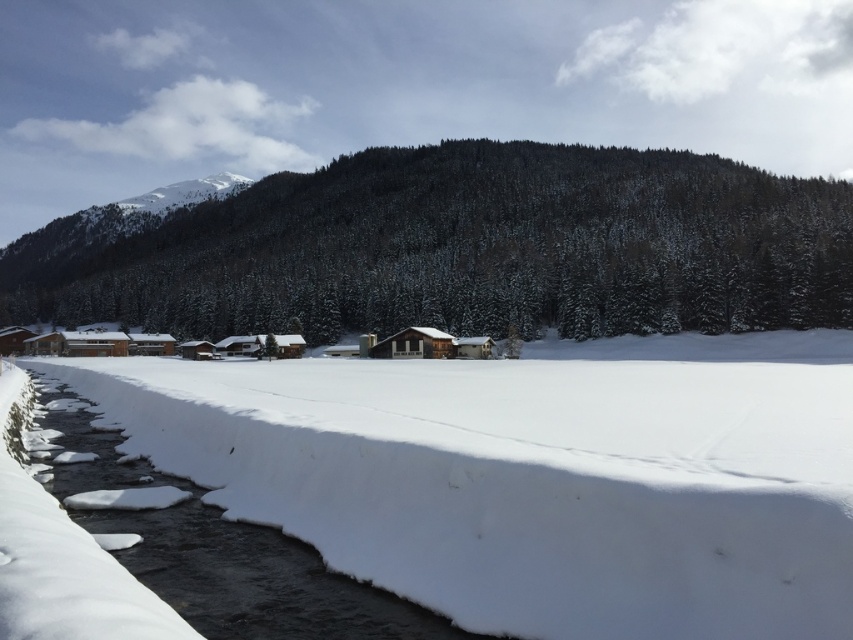
Question: Is snow-covered forest at center smaller than wooden cabin at center?

Choices:
 (A) yes
 (B) no

Answer: (B)

Question: Which point is farther to the camera?

Choices:
 (A) wooden cabin at center
 (B) white fluffy snow at lower left
 (C) snow-covered forest at center

Answer: (A)

Question: Which of the following is the closest to the observer?

Choices:
 (A) (397, 339)
 (B) (212, 456)

Answer: (B)

Question: Is white fluffy snow at lower left smaller than wooden cabin at center?

Choices:
 (A) yes
 (B) no

Answer: (B)

Question: Can you confirm if snow-covered forest at center is bigger than wooden cabin at center?

Choices:
 (A) yes
 (B) no

Answer: (A)

Question: Which point appears farthest from the camera in this image?

Choices:
 (A) (424, 337)
 (B) (486, 186)
 (C) (640, 368)

Answer: (B)